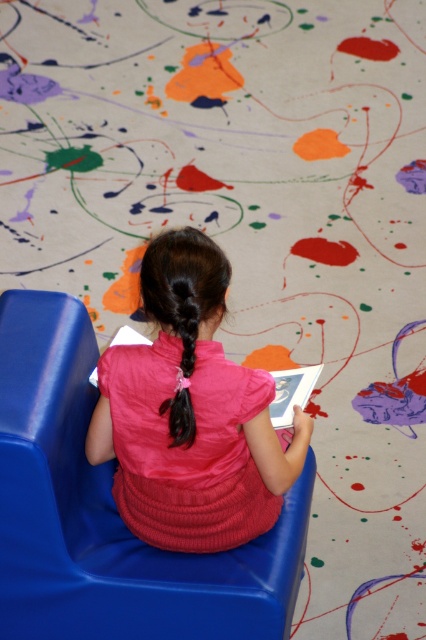
Question: Among these objects, which one is nearest to the camera?

Choices:
 (A) pink satin dress at center
 (B) blue plastic chair at center
 (C) black silky hair at center

Answer: (C)

Question: Can you confirm if blue plastic chair at center is positioned to the right of pink satin dress at center?

Choices:
 (A) no
 (B) yes

Answer: (A)

Question: Which point is closer to the camera?

Choices:
 (A) (186, 314)
 (B) (123, 621)
 (C) (161, 321)

Answer: (A)

Question: From the image, what is the correct spatial relationship of pink satin dress at center in relation to black silky hair at center?

Choices:
 (A) below
 (B) above

Answer: (A)

Question: In this image, where is blue plastic chair at center located relative to black silky hair at center?

Choices:
 (A) below
 (B) above

Answer: (A)

Question: Which of these objects is positioned closest to the blue plastic chair at center?

Choices:
 (A) black silky hair at center
 (B) pink satin dress at center

Answer: (B)